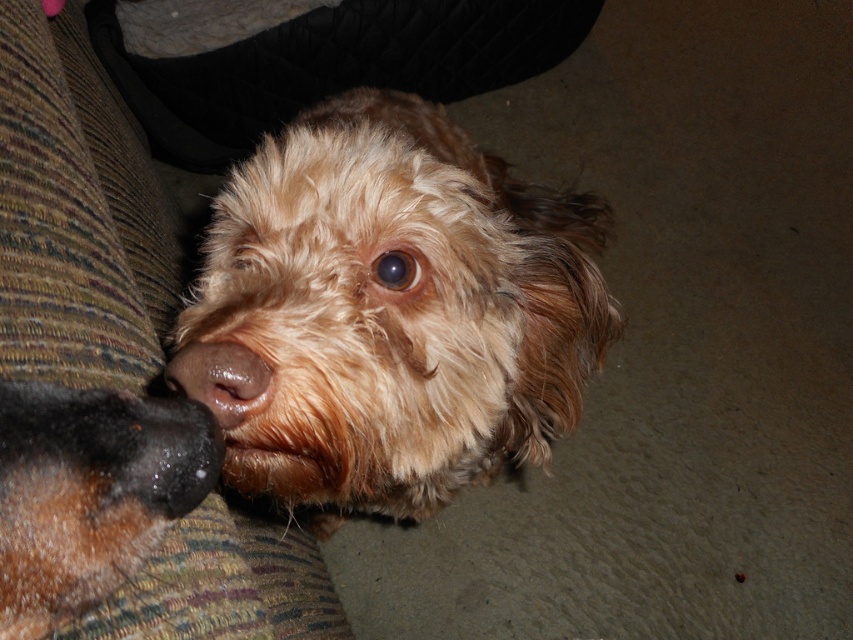
You are a photographer trying to capture the perfect shot of the fuzzy brown dog at center and the brown fuzzy nose at left. Based on their positions, which one should you focus on first if you want to ensure both are in sharp focus?

The fuzzy brown dog at center is above the brown fuzzy nose at left, so focusing on the fuzzy brown dog at center first will help ensure both are in sharp focus since it is closer to the camera.

You are standing in front of the couch where the small dog is resting. You notice two points marked in the image at coordinates point (x=196, y=465) and point (x=218, y=392). Which point is nearer to you?

Point (x=196, y=465) is closer to the viewer than point (x=218, y=392).

You are a photographer trying to capture the perfect shot of the fuzzy brown dog at center and the brown matte nose at center. You need to ensure that both subjects are fully visible in the frame. Given their sizes, which one might require more careful framing to avoid being cut off?

The fuzzy brown dog at center is wider than the brown matte nose at center, so the dog might require more careful framing to avoid being cut off due to its larger size.